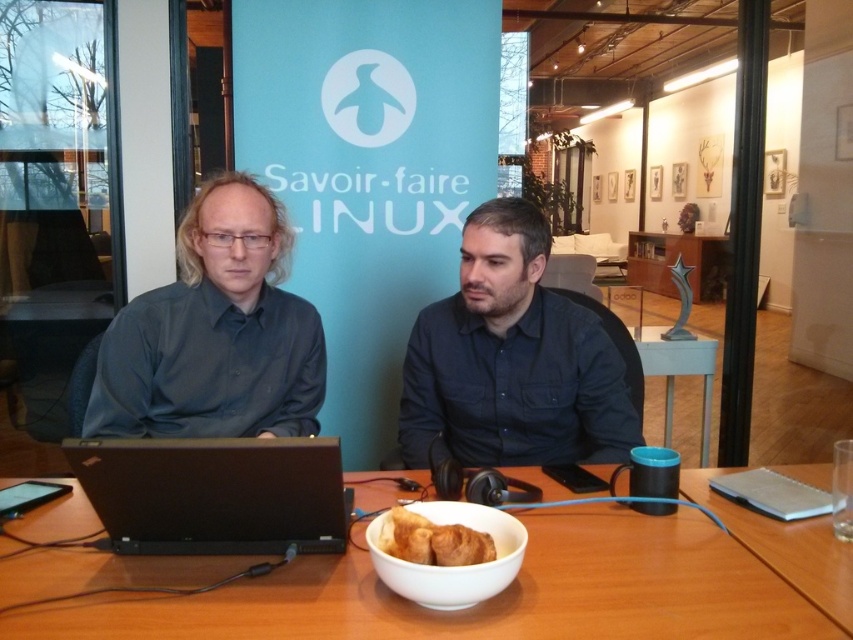
Does dark blue shirt at left come in front of golden brown croissant at center?

No, dark blue shirt at left is further to the viewer.

Identify the location of dark blue shirt at left. This screenshot has height=640, width=853. (215, 333).

Locate an element on the screen. The image size is (853, 640). dark blue shirt at left is located at coordinates (215, 333).

The image size is (853, 640). I want to click on dark blue shirt at left, so click(215, 333).

Does wooden table at center come behind white glossy bowl at lower center?

Yes.

Is wooden table at center to the left of white glossy bowl at lower center from the viewer's perspective?

In fact, wooden table at center is to the right of white glossy bowl at lower center.

This screenshot has width=853, height=640. What do you see at coordinates (492, 596) in the screenshot? I see `wooden table at center` at bounding box center [492, 596].

You are a GUI agent. You are given a task and a screenshot of the screen. Output one action in this format:
    pyautogui.click(x=<x>, y=<y>)
    Task: Click on the wooden table at center
    
    Given the screenshot: What is the action you would take?
    pyautogui.click(x=492, y=596)

Does point (442, 440) come closer to viewer compared to point (445, 596)?

No, it is not.

Does dark blue shirt at center have a larger size compared to white glossy bowl at lower center?

Yes.

You are a GUI agent. You are given a task and a screenshot of the screen. Output one action in this format:
    pyautogui.click(x=<x>, y=<y>)
    Task: Click on the dark blue shirt at center
    The height and width of the screenshot is (640, 853).
    Given the screenshot: What is the action you would take?
    pyautogui.click(x=511, y=360)

What are the coordinates of `dark blue shirt at center` in the screenshot? It's located at coord(511,360).